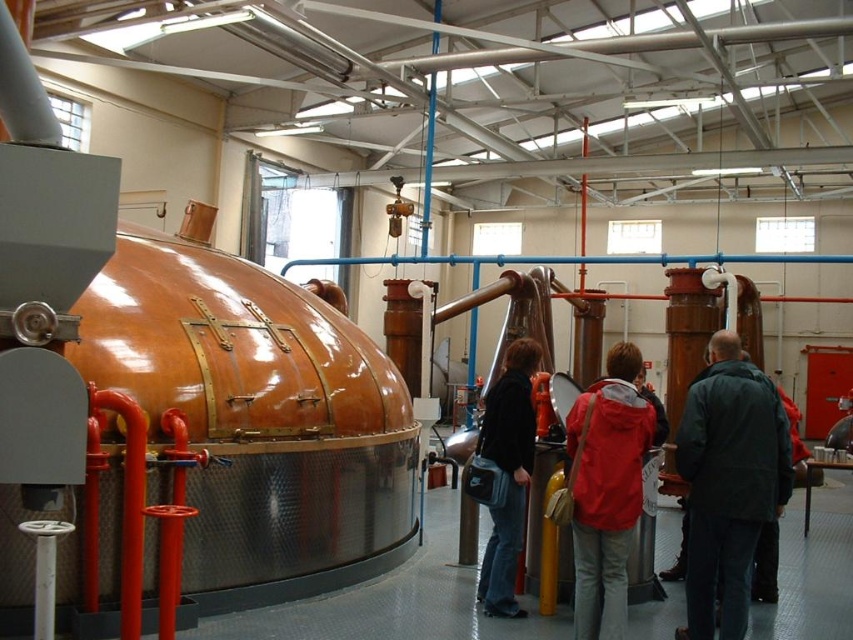
Between dark green jacket at center and red jacket at center, which one appears on the left side from the viewer's perspective?

From the viewer's perspective, red jacket at center appears more on the left side.

Where is `dark green jacket at center`? dark green jacket at center is located at coordinates (728, 483).

This screenshot has width=853, height=640. Describe the element at coordinates (728, 483) in the screenshot. I see `dark green jacket at center` at that location.

Find the location of `dark green jacket at center`. dark green jacket at center is located at coordinates (728, 483).

Can you confirm if red jacket at center is taller than black leather jacket at center?

Incorrect, red jacket at center's height is not larger of black leather jacket at center's.

Looking at this image, between red jacket at center and black leather jacket at center, which one appears on the left side from the viewer's perspective?

From the viewer's perspective, black leather jacket at center appears more on the left side.

Measure the distance between point (573, 563) and camera.

Point (573, 563) is 6.15 meters away from camera.

Identify the location of red jacket at center. (607, 490).

Consider the image. Can you confirm if dark green jacket at center is wider than black leather jacket at center?

Yes.

Which is more to the right, dark green jacket at center or black leather jacket at center?

dark green jacket at center

Is point (732, 369) positioned before point (511, 576)?

Yes, it is.

What are the coordinates of `dark green jacket at center` in the screenshot? It's located at [728, 483].